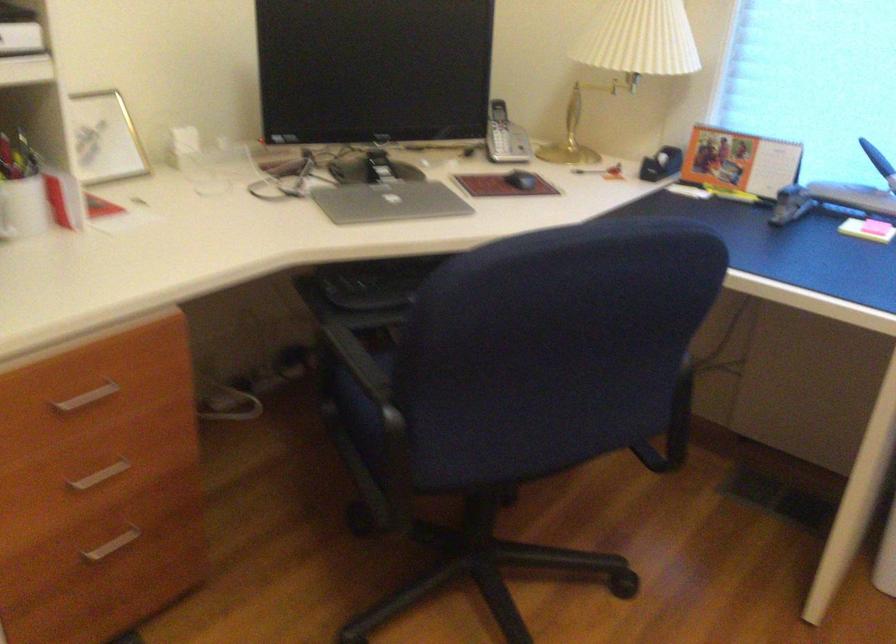
You are a GUI agent. You are given a task and a screenshot of the screen. Output one action in this format:
    pyautogui.click(x=<x>, y=<y>)
    Task: Click on the chair sitting surface
    The width and height of the screenshot is (896, 644).
    Given the screenshot: What is the action you would take?
    pyautogui.click(x=352, y=404)